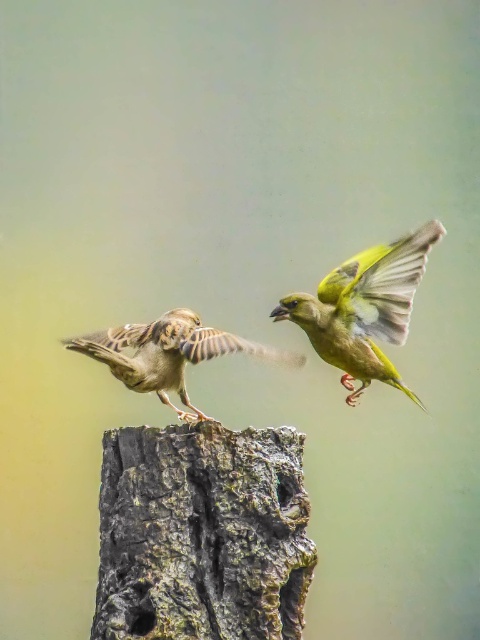
Question: Can you confirm if rough bark tree trunk at center is positioned below green glossy bird at center?

Choices:
 (A) yes
 (B) no

Answer: (A)

Question: Among these points, which one is nearest to the camera?

Choices:
 (A) (266, 448)
 (B) (348, 362)
 (C) (153, 355)

Answer: (A)

Question: Which of the following is the closest to the observer?

Choices:
 (A) (245, 618)
 (B) (412, 234)

Answer: (A)

Question: Which of the following is the closest to the observer?

Choices:
 (A) (103, 458)
 (B) (67, 339)

Answer: (A)

Question: Does rough bark tree trunk at center appear on the right side of green glossy bird at center?

Choices:
 (A) no
 (B) yes

Answer: (A)

Question: Is rough bark tree trunk at center closer to camera compared to green glossy bird at center?

Choices:
 (A) no
 (B) yes

Answer: (B)